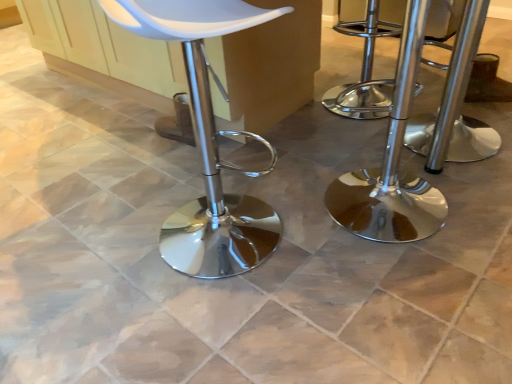
Describe the element at coordinates (455, 106) in the screenshot. The width and height of the screenshot is (512, 384). I see `polished chrome stool at center, the first stool when ordered from right to left` at that location.

I want to click on chrome/metallic stool at right, the second stool positioned from the right, so click(x=392, y=164).

The image size is (512, 384). What do you see at coordinates (392, 164) in the screenshot?
I see `chrome/metallic stool at right, the second stool positioned from the right` at bounding box center [392, 164].

Identify the location of white matte stool at center. (207, 141).

What's the angular difference between chrome/metallic stool at right, the second stool positioned from the right, and polished chrome stool at center, the first stool when ordered from right to left,'s facing directions?

The angle between the facing direction of chrome/metallic stool at right, the second stool positioned from the right, and the facing direction of polished chrome stool at center, the first stool when ordered from right to left, is 73.9 degrees.

Does chrome/metallic stool at right, acting as the first stool starting from the left, lie in front of polished chrome stool at center, the first stool when ordered from right to left?

Yes, chrome/metallic stool at right, acting as the first stool starting from the left, is in front of polished chrome stool at center, the first stool when ordered from right to left.

Is chrome/metallic stool at right, the second stool positioned from the right, with polished chrome stool at center, the first stool when ordered from right to left?

chrome/metallic stool at right, the second stool positioned from the right, is not next to polished chrome stool at center, the first stool when ordered from right to left, and they're not touching.

From the image's perspective, relative to polished chrome stool at center, which is the 2th stool from left to right, is chrome/metallic stool at right, the second stool positioned from the right, above or below?

chrome/metallic stool at right, the second stool positioned from the right, is situated lower than polished chrome stool at center, which is the 2th stool from left to right, in the image.

Does polished chrome stool at center, the first stool when ordered from right to left, have a greater height compared to white matte stool at center?

In fact, polished chrome stool at center, the first stool when ordered from right to left, may be shorter than white matte stool at center.

Can you confirm if polished chrome stool at center, which is the 2th stool from left to right, is smaller than white matte stool at center?

Yes, polished chrome stool at center, which is the 2th stool from left to right, is smaller than white matte stool at center.

Is polished chrome stool at center, the first stool when ordered from right to left, directly adjacent to white matte stool at center?

There is a gap between polished chrome stool at center, the first stool when ordered from right to left, and white matte stool at center.

Is white matte stool at center located within polished chrome stool at center, the first stool when ordered from right to left?

No, white matte stool at center is located outside of polished chrome stool at center, the first stool when ordered from right to left.

Considering their positions, is white matte stool at center located in front of or behind chrome/metallic stool at right, the second stool positioned from the right?

Visually, white matte stool at center is located in front of chrome/metallic stool at right, the second stool positioned from the right.

Would you say white matte stool at center is inside or outside chrome/metallic stool at right, acting as the first stool starting from the left?

white matte stool at center is not enclosed by chrome/metallic stool at right, acting as the first stool starting from the left.

Which of these two, white matte stool at center or chrome/metallic stool at right, acting as the first stool starting from the left, is bigger?

white matte stool at center is bigger.

Is white matte stool at center facing away from chrome/metallic stool at right, acting as the first stool starting from the left?

No, chrome/metallic stool at right, acting as the first stool starting from the left, is not at the back of white matte stool at center.

Is white matte stool at center not within polished chrome stool at center, which is the 2th stool from left to right?

Yes, white matte stool at center is not within polished chrome stool at center, which is the 2th stool from left to right.

From a real-world perspective, is white matte stool at center below polished chrome stool at center, the first stool when ordered from right to left?

No, from a real-world perspective, white matte stool at center is not beneath polished chrome stool at center, the first stool when ordered from right to left.

Does point (191, 48) come behind point (434, 140)?

No, (191, 48) is in front of (434, 140).

Looking at this image, looking at their sizes, would you say white matte stool at center is wider or thinner than polished chrome stool at center, which is the 2th stool from left to right?

Considering their sizes, white matte stool at center looks broader than polished chrome stool at center, which is the 2th stool from left to right.

Is chrome/metallic stool at right, the second stool positioned from the right, bigger or smaller than white matte stool at center?

Considering their sizes, chrome/metallic stool at right, the second stool positioned from the right, takes up less space than white matte stool at center.

At what (x,y) coordinates should I click in order to perform the action: click on chair in front of the chrome/metallic stool at right, acting as the first stool starting from the left. Please return your answer as a coordinate pair (x, y). Looking at the image, I should click on (207, 141).

From the image's perspective, between chrome/metallic stool at right, the second stool positioned from the right, and white matte stool at center, who is located below?

white matte stool at center appears lower in the image.

Would you say chrome/metallic stool at right, the second stool positioned from the right, is part of polished chrome stool at center, which is the 2th stool from left to right,'s contents?

No, chrome/metallic stool at right, the second stool positioned from the right, is not a part of polished chrome stool at center, which is the 2th stool from left to right.

Between point (454, 79) and point (408, 85), which one is positioned in front?

Positioned in front is point (454, 79).

From the picture: Based on their positions, is polished chrome stool at center, the first stool when ordered from right to left, located to the left or right of chrome/metallic stool at right, the second stool positioned from the right?

In the image, polished chrome stool at center, the first stool when ordered from right to left, appears on the right side of chrome/metallic stool at right, the second stool positioned from the right.

Does polished chrome stool at center, the first stool when ordered from right to left, have a greater height compared to chrome/metallic stool at right, acting as the first stool starting from the left?

No.

What are the coordinates of `stool that is below the polished chrome stool at center, the first stool when ordered from right to left (from the image's perspective)` in the screenshot? It's located at (392, 164).

The height and width of the screenshot is (384, 512). There is a white matte stool at center. In order to click on the 2nd stool below it (from a real-world perspective) in this screenshot , I will do (x=455, y=106).

Estimate the real-world distances between objects in this image. Which object is closer to chrome/metallic stool at right, the second stool positioned from the right, polished chrome stool at center, which is the 2th stool from left to right, or white matte stool at center?

Based on the image, polished chrome stool at center, which is the 2th stool from left to right, appears to be nearer to chrome/metallic stool at right, the second stool positioned from the right.

From the image, which object appears to be nearer to polished chrome stool at center, which is the 2th stool from left to right, chrome/metallic stool at right, acting as the first stool starting from the left, or white matte stool at center?

chrome/metallic stool at right, acting as the first stool starting from the left, is closer to polished chrome stool at center, which is the 2th stool from left to right.

From the image, which object appears to be farther from white matte stool at center, polished chrome stool at center, which is the 2th stool from left to right, or chrome/metallic stool at right, the second stool positioned from the right?

polished chrome stool at center, which is the 2th stool from left to right, is positioned further to the anchor white matte stool at center.

Based on their spatial positions, is chrome/metallic stool at right, the second stool positioned from the right, or polished chrome stool at center, which is the 2th stool from left to right, further from white matte stool at center?

polished chrome stool at center, which is the 2th stool from left to right.

In the scene shown: Which object lies nearer to the anchor point chrome/metallic stool at right, acting as the first stool starting from the left, white matte stool at center or polished chrome stool at center, which is the 2th stool from left to right?

polished chrome stool at center, which is the 2th stool from left to right.

Based on their spatial positions, is white matte stool at center or chrome/metallic stool at right, the second stool positioned from the right, further from polished chrome stool at center, the first stool when ordered from right to left?

Based on the image, white matte stool at center appears to be further to polished chrome stool at center, the first stool when ordered from right to left.

Find the location of a particular element. The image size is (512, 384). stool between white matte stool at center and polished chrome stool at center, which is the 2th stool from left to right is located at coordinates (392, 164).